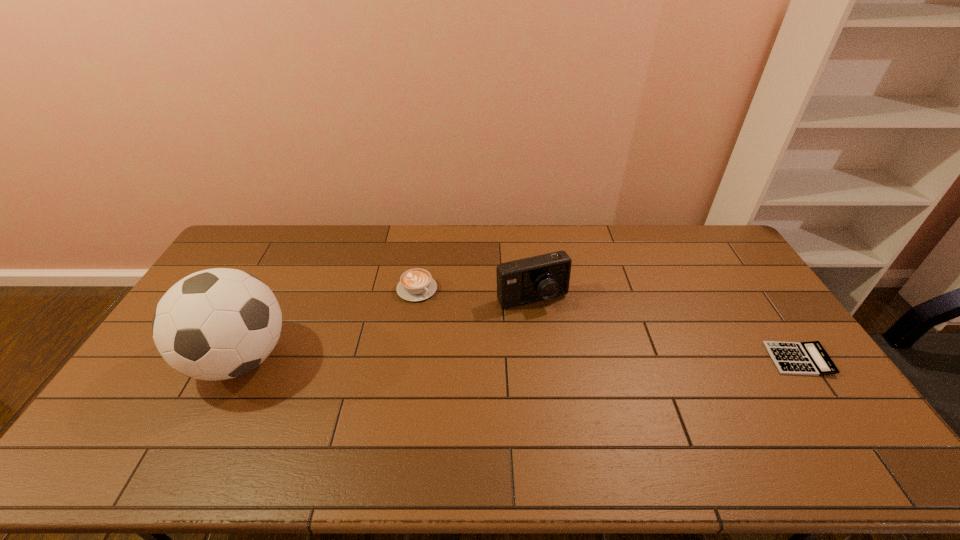
In the image, there is a desktop. At what (x,y) coordinates should I click in order to perform the action: click on vacant space at the far edge. Please return your answer as a coordinate pair (x, y). This screenshot has width=960, height=540. Looking at the image, I should click on (663, 235).

You are a GUI agent. You are given a task and a screenshot of the screen. Output one action in this format:
    pyautogui.click(x=<x>, y=<y>)
    Task: Click on the vacant area at the near edge
    This screenshot has height=540, width=960.
    Given the screenshot: What is the action you would take?
    pyautogui.click(x=295, y=410)

At what (x,y) coordinates should I click in order to perform the action: click on free space at the right edge. Please return your answer as a coordinate pair (x, y). Looking at the image, I should click on (722, 298).

The width and height of the screenshot is (960, 540). What are the coordinates of `vacant space at the far left corner` in the screenshot? It's located at (238, 234).

In the image, there is a desktop. Where is `vacant region at the near left corner`? This screenshot has height=540, width=960. vacant region at the near left corner is located at coordinates (144, 421).

Identify the location of vacant area at the near right corner of the desktop. (791, 422).

At what (x,y) coordinates should I click in order to perform the action: click on free space between the third shortest object and the shortest object. Please return your answer as a coordinate pair (x, y). The height and width of the screenshot is (540, 960). Looking at the image, I should click on (665, 329).

The width and height of the screenshot is (960, 540). In order to click on vacant area that lies between the calculator and the third tallest object in this screenshot , I will do `click(608, 324)`.

Find the location of a particular element. The width and height of the screenshot is (960, 540). unoccupied position between the camera and the calculator is located at coordinates (665, 329).

Locate an element on the screen. free space between the second shortest object and the tallest object is located at coordinates (328, 324).